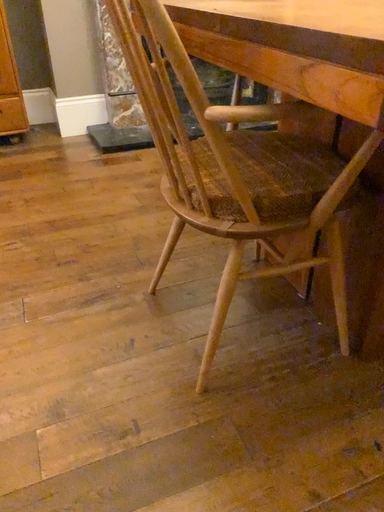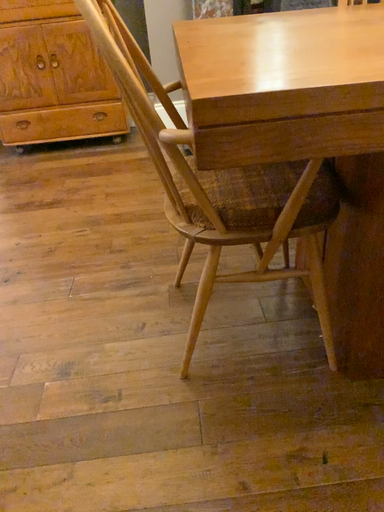
Question: Which way did the camera rotate in the video?

Choices:
 (A) rotated left
 (B) rotated right

Answer: (A)